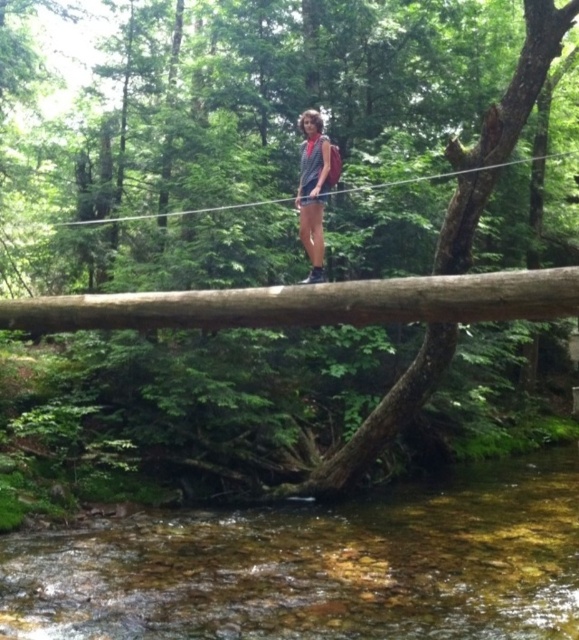
You are a hiker navigating a forest trail and need to cross a stream using the fallen tree trunk. You notice two points marked on the log bridge. One is at point [477,579] and the other at point [316,188]. Which point is closer to you as you stand on the bridge facing the camera?

Point [477,579] is further to the camera than point [316,188], so the point closer to you is point [316,188].

You are a hiker navigating a forest trail and come across a stream. You see a point marked at coordinates [317,566]. What is located at this point?

The point marked at coordinates [317,566] is clear water at center.